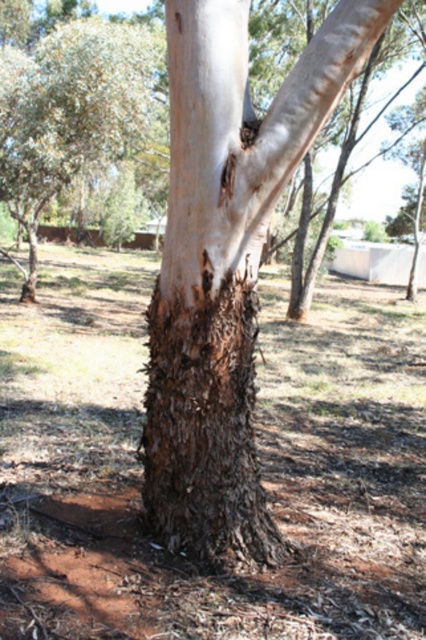
Question: Does brown rough bark at center have a greater width compared to rough bark tree at center?

Choices:
 (A) no
 (B) yes

Answer: (B)

Question: Can you confirm if brown rough bark at center is positioned to the right of rough bark tree at center?

Choices:
 (A) yes
 (B) no

Answer: (A)

Question: Does brown rough bark at center appear on the right side of rough bark tree at center?

Choices:
 (A) no
 (B) yes

Answer: (B)